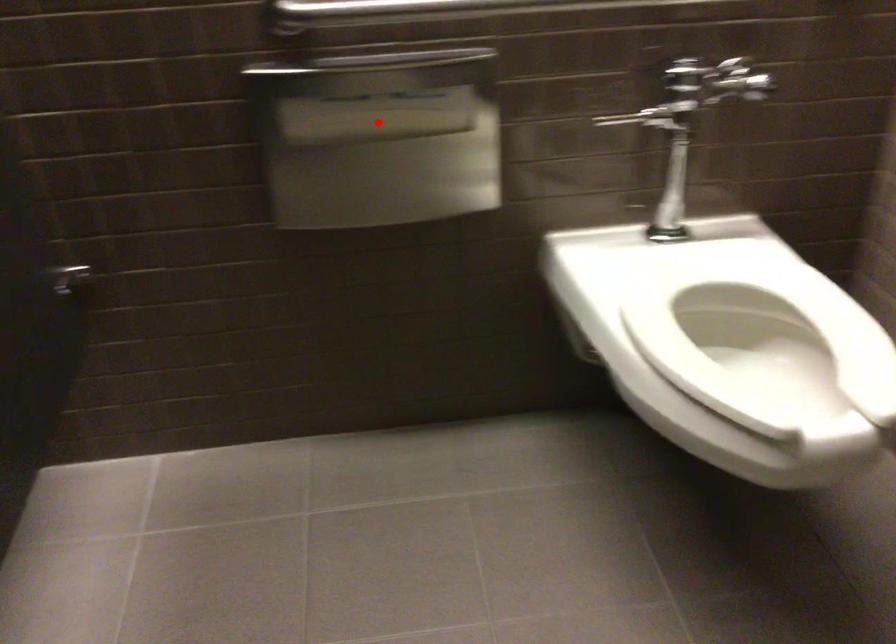
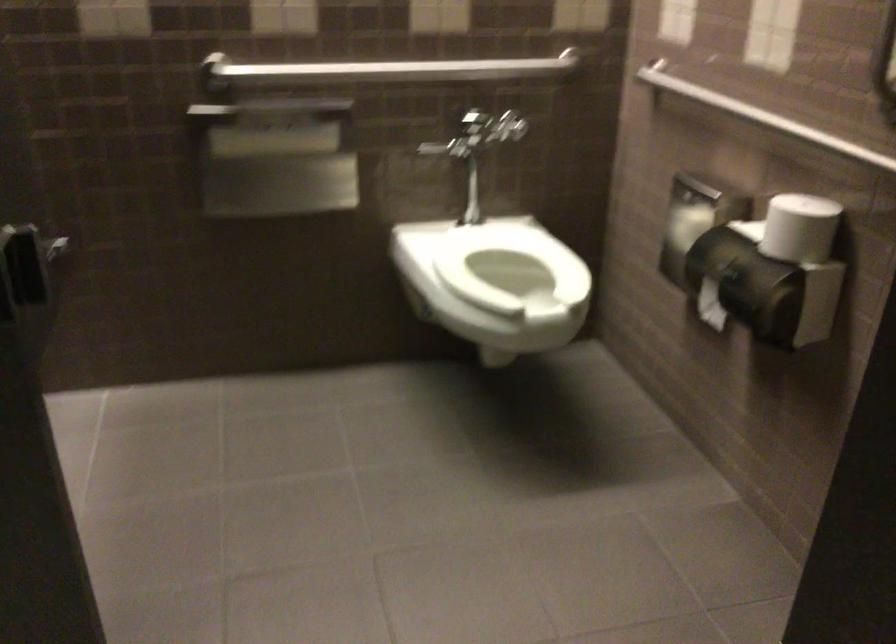
Question: I am providing you with two images of the same scene from different viewpoints. In image1, a red point is highlighted. Considering the same 3D point in image2, which of the following is correct?

Choices:
 (A) It is closer
 (B) It is farther

Answer: (B)